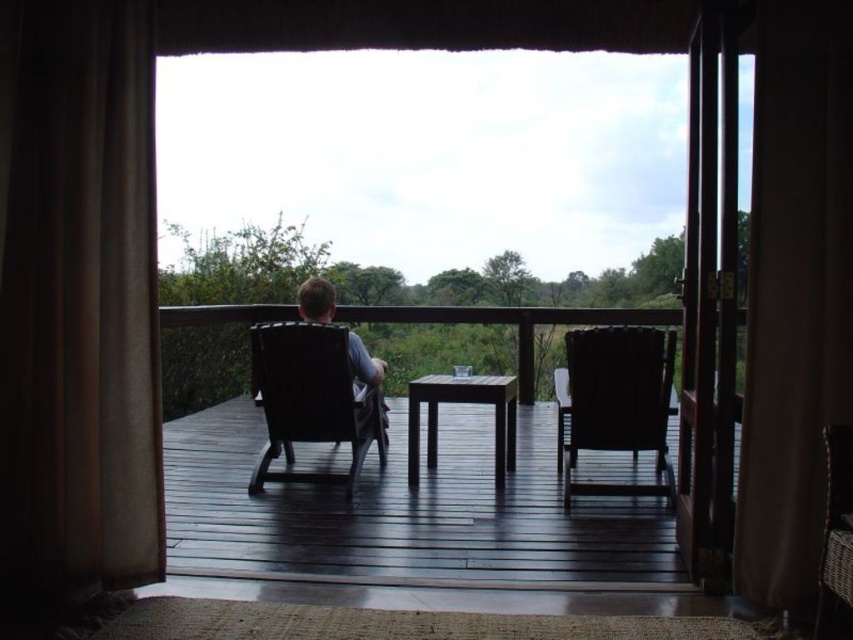
You are standing inside the room and want to move to the deck. The door is open, and you see the dark wood deck at center and the matte black chair at center. Which object is on the right side when viewed from the room?

The dark wood deck at center is positioned on the right side of matte black chair at center, so when viewed from the room, the dark wood deck at center is on the right side.

You are standing at the entrance of the room and want to place a new potted plant exactly at point (311, 400). What object will the plant be placed on top of?

The point (311, 400) is occupied by a matte black chair at center, so the plant cannot be placed there as it is already occupied by the chair.

You are planning to move a large potted plant that is 1.5 meters wide through the transparent glass door at center. Considering the dark wood deck at center is wider than the door, will the plant fit through the door?

The dark wood deck at center is wider than the transparent glass door at center. Since the plant is 1.5 meters wide and the door is narrower than the deck, the plant may not fit through the door. Measure the door width before attempting to move the plant.